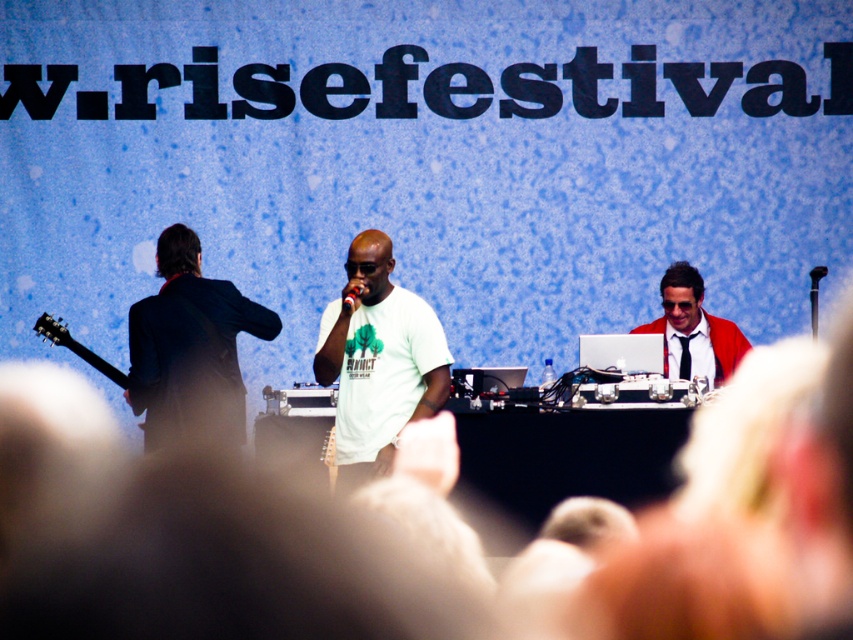
You are standing at the center of the stage at the Rise Festival. You see a point marked at coordinates (378, 362). What object is located at that point?

The point at (378, 362) indicates the white matte tshirt at center.

You are a photographer at the Rise Festival trying to capture a wide shot of the stage. You notice the dark blue suit at left and the shiny red jacket at center. Which performer should you adjust your camera angle to focus on to ensure both are in frame without cropping?

The dark blue suit at left is wider than the shiny red jacket at center, so adjusting the camera angle to focus on the dark blue suit at left will ensure both performers are in frame without cropping.